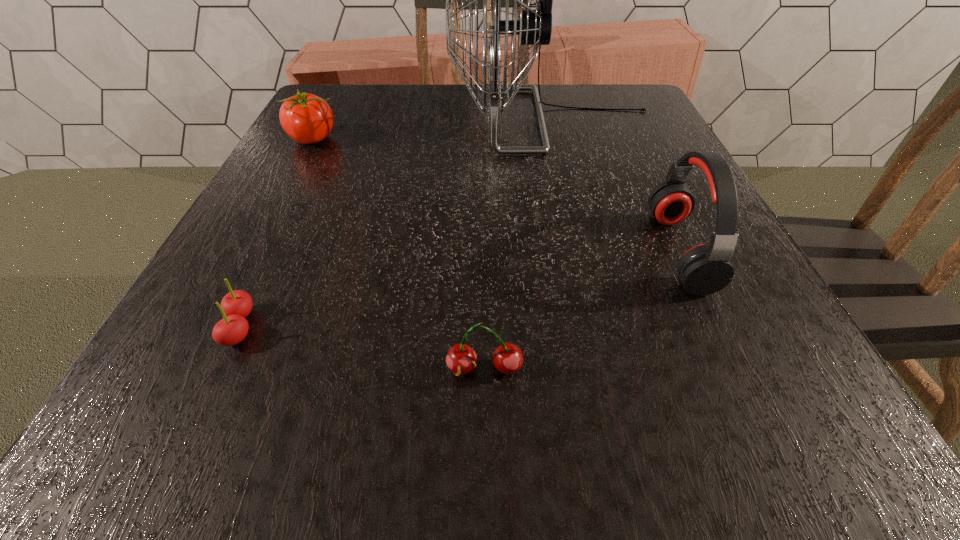
Where is `fan`? fan is located at coordinates (534, 27).

Identify the location of earphone. The height and width of the screenshot is (540, 960). [705, 269].

This screenshot has width=960, height=540. Identify the location of the third nearest object. (705, 269).

The width and height of the screenshot is (960, 540). I want to click on tomato, so click(x=306, y=118).

The height and width of the screenshot is (540, 960). Identify the location of the right cherry. (461, 359).

I want to click on the nearer cherry, so click(461, 359).

This screenshot has height=540, width=960. I want to click on the farther cherry, so click(x=236, y=305).

You are a GUI agent. You are given a task and a screenshot of the screen. Output one action in this format:
    pyautogui.click(x=<x>, y=<y>)
    Task: Click on the left cherry
    The image size is (960, 540).
    Given the screenshot: What is the action you would take?
    pyautogui.click(x=236, y=305)

What are the coordinates of `free space located on the front-facing side of the fan` in the screenshot? It's located at (351, 120).

You are a GUI agent. You are given a task and a screenshot of the screen. Output one action in this format:
    pyautogui.click(x=<x>, y=<y>)
    Task: Click on the vacant point located on the front-facing side of the fan
    This screenshot has width=960, height=540.
    Given the screenshot: What is the action you would take?
    pyautogui.click(x=382, y=120)